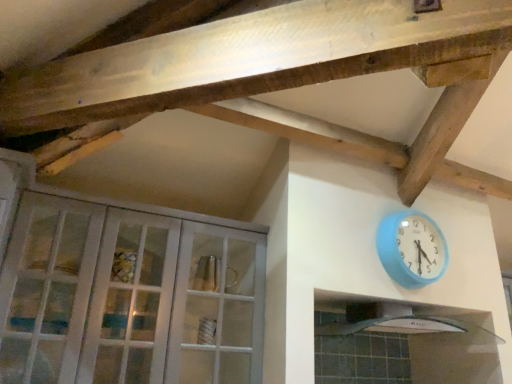
Where is `blue plastic wall clock at upper right`? This screenshot has width=512, height=384. blue plastic wall clock at upper right is located at coordinates (411, 249).

In order to face white glass cabinet at left, should I rotate leftwards or rightwards?

A: You should rotate left by 15.391 degrees.

Find the location of a particular element. The height and width of the screenshot is (384, 512). white glass cabinet at left is located at coordinates [x=124, y=289].

Find the location of a particular element. white glossy exhaust hood at lower right is located at coordinates (399, 325).

Can you confirm if blue plastic wall clock at upper right is shorter than white glossy exhaust hood at lower right?

No, blue plastic wall clock at upper right is not shorter than white glossy exhaust hood at lower right.

Measure the distance between blue plastic wall clock at upper right and white glossy exhaust hood at lower right.

blue plastic wall clock at upper right is 10.99 inches away from white glossy exhaust hood at lower right.

Is blue plastic wall clock at upper right wider or thinner than white glossy exhaust hood at lower right?

Considering their sizes, blue plastic wall clock at upper right looks slimmer than white glossy exhaust hood at lower right.

The image size is (512, 384). What are the coordinates of `cabinetry in front of the white glossy exhaust hood at lower right` in the screenshot? It's located at (124, 289).

Considering the sizes of objects white glossy exhaust hood at lower right and white glass cabinet at left in the image provided, who is thinner, white glossy exhaust hood at lower right or white glass cabinet at left?

white glass cabinet at left is thinner.

Is white glossy exhaust hood at lower right next to white glass cabinet at left and touching it?

white glossy exhaust hood at lower right and white glass cabinet at left are clearly separated.

From the image's perspective, is white glossy exhaust hood at lower right located above or below white glass cabinet at left?

Clearly, from the image's perspective, white glossy exhaust hood at lower right is below white glass cabinet at left.

Based on the photo, can you confirm if white glass cabinet at left is thinner than blue plastic wall clock at upper right?

No, white glass cabinet at left is not thinner than blue plastic wall clock at upper right.

Who is bigger, white glass cabinet at left or blue plastic wall clock at upper right?

white glass cabinet at left is bigger.

Is white glass cabinet at left completely or partially outside of blue plastic wall clock at upper right?

Absolutely, white glass cabinet at left is external to blue plastic wall clock at upper right.

Is white glass cabinet at left in contact with blue plastic wall clock at upper right?

No, white glass cabinet at left is not beside blue plastic wall clock at upper right.

Is blue plastic wall clock at upper right oriented away from white glass cabinet at left?

No, white glass cabinet at left is not at the back of blue plastic wall clock at upper right.

Between blue plastic wall clock at upper right and white glass cabinet at left, which one appears on the left side from the viewer's perspective?

white glass cabinet at left.

Looking at this image, would you consider blue plastic wall clock at upper right to be distant from white glass cabinet at left?

No, blue plastic wall clock at upper right is in close proximity to white glass cabinet at left.

Considering the sizes of objects white glass cabinet at left and white glossy exhaust hood at lower right in the image provided, who is smaller, white glass cabinet at left or white glossy exhaust hood at lower right?

white glossy exhaust hood at lower right is smaller.

Does white glass cabinet at left lie behind white glossy exhaust hood at lower right?

No, white glass cabinet at left is closer to the viewer.

This screenshot has width=512, height=384. I want to click on exhaust hood located underneath the white glass cabinet at left (from a real-world perspective), so click(x=399, y=325).

Would you say white glass cabinet at left is a long distance from white glossy exhaust hood at lower right?

Yes, white glass cabinet at left and white glossy exhaust hood at lower right are located far from each other.

Is white glossy exhaust hood at lower right situated inside blue plastic wall clock at upper right or outside?

The correct answer is: outside.

Is white glossy exhaust hood at lower right to the right of blue plastic wall clock at upper right from the viewer's perspective?

In fact, white glossy exhaust hood at lower right is to the left of blue plastic wall clock at upper right.

What are the coordinates of `wall clock behind the white glossy exhaust hood at lower right` in the screenshot? It's located at (411, 249).

At what (x,y) coordinates should I click in order to perform the action: click on wall clock above the white glossy exhaust hood at lower right (from the image's perspective). Please return your answer as a coordinate pair (x, y). This screenshot has width=512, height=384. Looking at the image, I should click on (411, 249).

At what (x,y) coordinates should I click in order to perform the action: click on cabinetry on the left of white glossy exhaust hood at lower right. Please return your answer as a coordinate pair (x, y). The width and height of the screenshot is (512, 384). Looking at the image, I should click on (124, 289).

Looking at the image, which one is located closer to blue plastic wall clock at upper right, white glass cabinet at left or white glossy exhaust hood at lower right?

Among the two, white glossy exhaust hood at lower right is located nearer to blue plastic wall clock at upper right.

Looking at the image, which one is located further to white glossy exhaust hood at lower right, white glass cabinet at left or blue plastic wall clock at upper right?

white glass cabinet at left is further to white glossy exhaust hood at lower right.

Looking at the image, which one is located further to white glossy exhaust hood at lower right, blue plastic wall clock at upper right or white glass cabinet at left?

white glass cabinet at left is positioned further to the anchor white glossy exhaust hood at lower right.

From the picture: Estimate the real-world distances between objects in this image. Which object is further from white glass cabinet at left, white glossy exhaust hood at lower right or blue plastic wall clock at upper right?

white glossy exhaust hood at lower right is further to white glass cabinet at left.

In the scene shown: Based on their spatial positions, is blue plastic wall clock at upper right or white glossy exhaust hood at lower right further from white glass cabinet at left?

white glossy exhaust hood at lower right is further to white glass cabinet at left.

Considering their positions, is white glossy exhaust hood at lower right positioned further to blue plastic wall clock at upper right than white glass cabinet at left?

white glass cabinet at left.

Find the location of `exhaust hood between white glass cabinet at left and blue plastic wall clock at upper right`. exhaust hood between white glass cabinet at left and blue plastic wall clock at upper right is located at coordinates (399, 325).